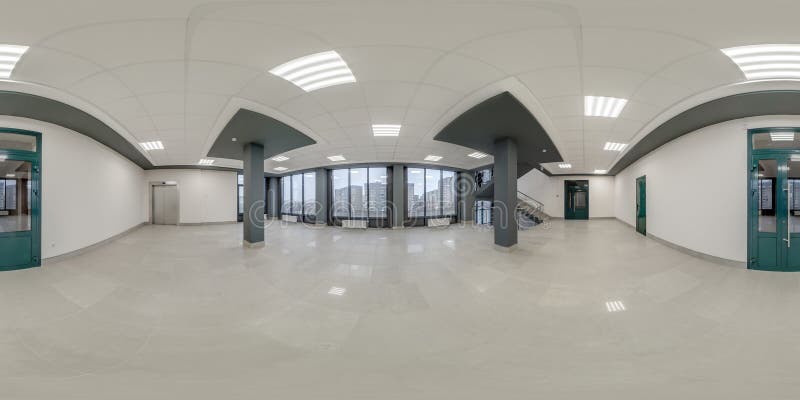
You are a GUI agent. You are given a task and a screenshot of the screen. Output one action in this format:
    pyautogui.click(x=<x>, y=<y>)
    Task: Click on the ceiling
    The image size is (800, 400).
    Given the screenshot: What is the action you would take?
    pyautogui.click(x=430, y=37)